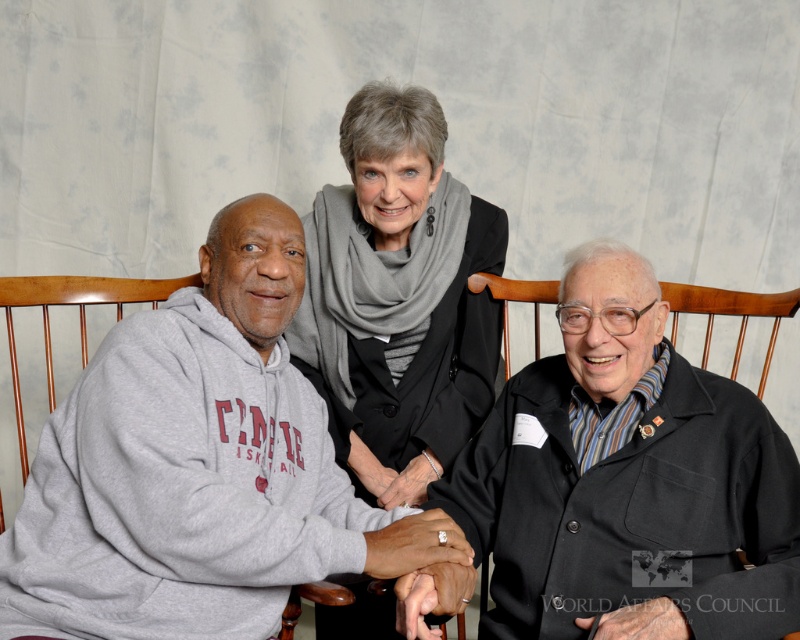
Can you confirm if black wool coat at right is taller than gray wool scarf at center?

Incorrect, black wool coat at right's height is not larger of gray wool scarf at center's.

Which of these two, black wool coat at right or gray wool scarf at center, stands taller?

gray wool scarf at center is taller.

What do you see at coordinates (628, 481) in the screenshot?
I see `black wool coat at right` at bounding box center [628, 481].

Identify the location of black wool coat at right. (628, 481).

In the scene shown: Between gray hoodie at left and gray wool scarf at center, which one is positioned lower?

gray hoodie at left

Does point (284, 403) come behind point (336, 387)?

No, (284, 403) is closer to viewer.

Locate an element on the screen. The image size is (800, 640). gray hoodie at left is located at coordinates (206, 467).

Who is lower down, gray hoodie at left or black wool coat at right?

gray hoodie at left is below.

Is point (90, 454) in front of point (529, 512)?

Yes, it is.

Measure the distance between point (250, 579) and camera.

They are 1.30 meters apart.

You are a GUI agent. You are given a task and a screenshot of the screen. Output one action in this format:
    pyautogui.click(x=<x>, y=<y>)
    Task: Click on the gray hoodie at left
    The width and height of the screenshot is (800, 640).
    Given the screenshot: What is the action you would take?
    pyautogui.click(x=206, y=467)